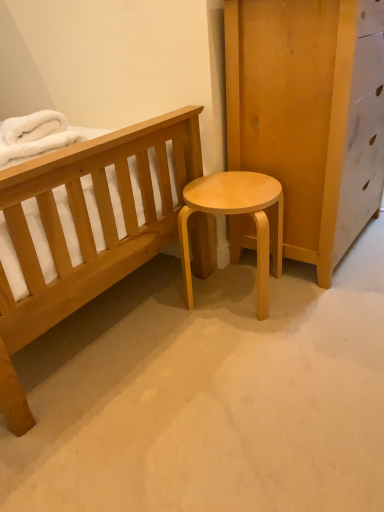
Where is `free space above light wood/matte stool at center (from a real-world perspective)`? Image resolution: width=384 pixels, height=512 pixels. free space above light wood/matte stool at center (from a real-world perspective) is located at coordinates (228, 187).